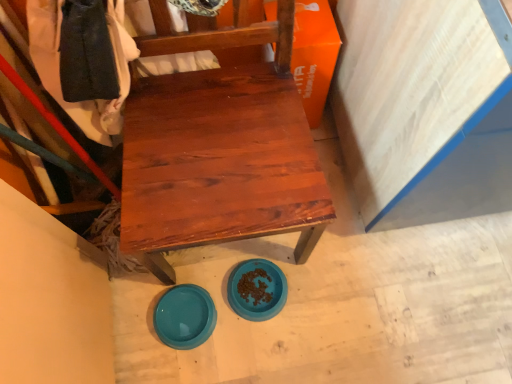
The width and height of the screenshot is (512, 384). In order to click on free space behind teal glossy plate at lower center, which is the second plate in right-to-left order in this screenshot , I will do `click(200, 267)`.